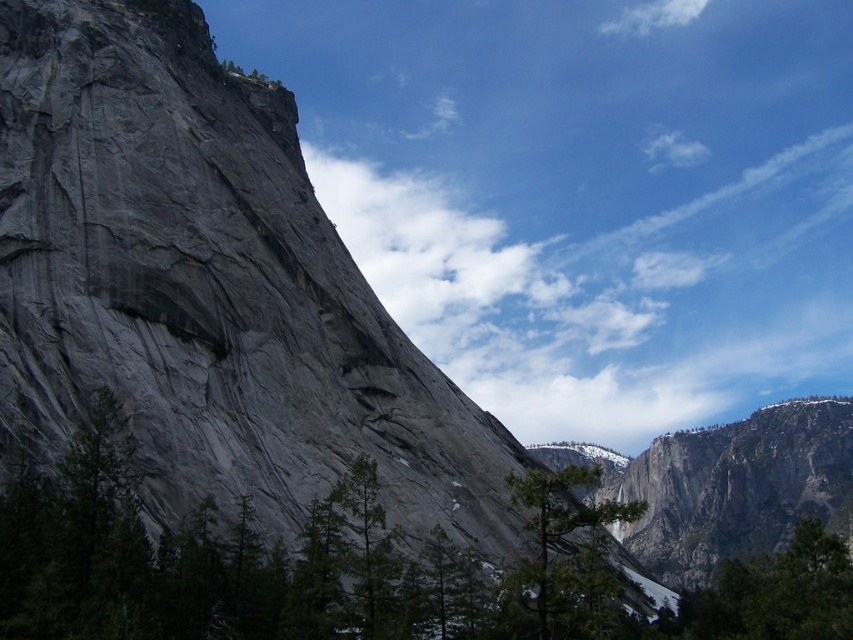
Question: Does green matte tree at center appear on the right side of green matte tree at lower right?

Choices:
 (A) no
 (B) yes

Answer: (A)

Question: Which object appears closest to the camera in this image?

Choices:
 (A) green matte tree at lower right
 (B) white fluffy cloud at upper center
 (C) green matte tree at center

Answer: (C)

Question: Which object is the farthest from the green matte tree at center?

Choices:
 (A) white fluffy cloud at upper center
 (B) green matte tree at lower right

Answer: (A)

Question: Can you confirm if green matte tree at lower right is thinner than white fluffy cloud at upper center?

Choices:
 (A) no
 (B) yes

Answer: (A)

Question: Is green matte tree at lower right closer to the viewer compared to white fluffy cloud at upper center?

Choices:
 (A) yes
 (B) no

Answer: (A)

Question: Considering the real-world distances, which object is farthest from the green matte tree at lower right?

Choices:
 (A) white fluffy cloud at upper center
 (B) green matte tree at center

Answer: (A)